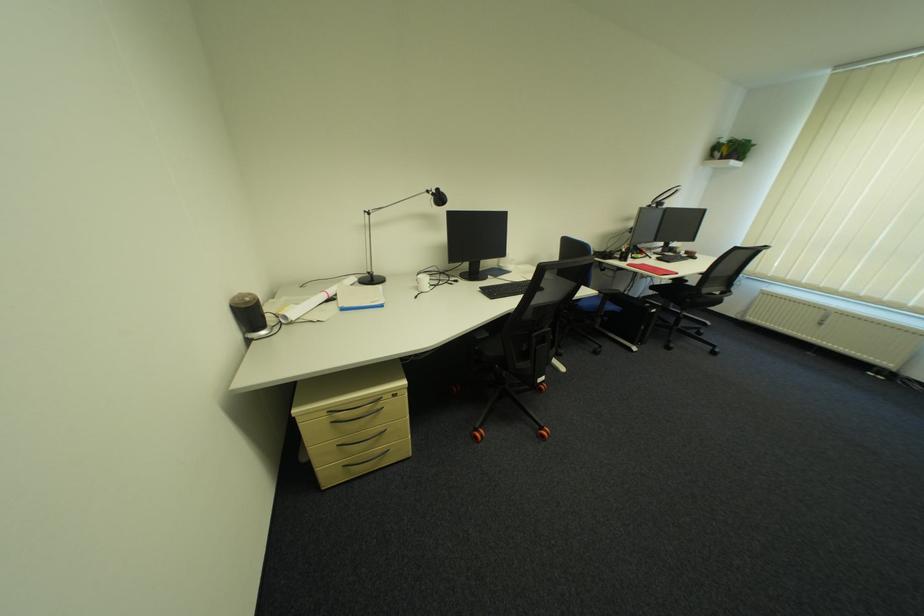
Identify the location of black computer keyboard. This screenshot has height=616, width=924. (505, 289).